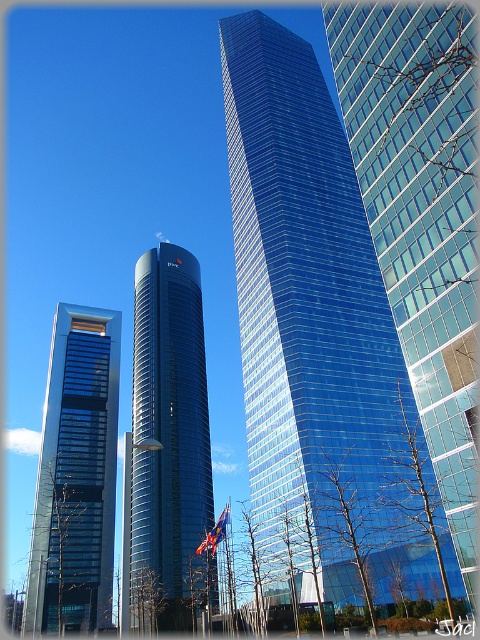
You are an architect planning to install a flagpole on the roof of the smooth glass tower at center and the matte glass skyscraper at left. Which building requires a taller flagpole to ensure visibility from the ground?

The smooth glass tower at center is taller than the matte glass skyscraper at left, so installing a taller flagpole on its roof would ensure better visibility from the ground.

You are standing at the origin point of a coordinate system where the image is mapped to a grid from 0 to 1 in both x and y axes. You want to locate the smooth glass tower at center. What are its coordinates?

The smooth glass tower at center is located at coordinates point (167, 449).

You are an architect analyzing the urban layout. From your vantage point, which skyscraper appears higher in the visual field? The glassy blue skyscraper at center or the matte glass skyscraper at left?

The glassy blue skyscraper at center appears higher in the visual field because it is located above the matte glass skyscraper at left.